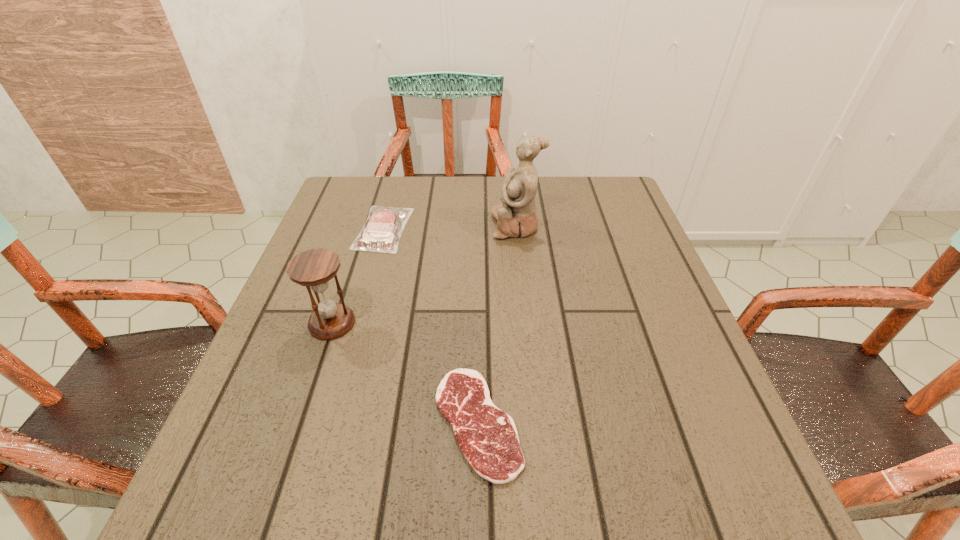
Locate an element on the screen. vacant position located 0.170m on the back of the hourglass is located at coordinates (354, 255).

Locate an element on the screen. free space located 0.340m on the front of the left steak is located at coordinates (344, 374).

Identify the location of free space located 0.240m on the back of the shortest object. Image resolution: width=960 pixels, height=540 pixels. (478, 282).

Where is `figurine that is positioned at the far edge`? The image size is (960, 540). figurine that is positioned at the far edge is located at coordinates (516, 216).

Where is `steak located at the far edge`? This screenshot has height=540, width=960. steak located at the far edge is located at coordinates (382, 230).

In order to click on object located at the near edge in this screenshot , I will do `click(487, 436)`.

Identify the location of hourglass that is at the left edge. (x=313, y=268).

Find the location of a particular element. The height and width of the screenshot is (540, 960). steak present at the left edge is located at coordinates (382, 230).

At what (x,y) coordinates should I click in order to perform the action: click on object that is at the far left corner. Please return your answer as a coordinate pair (x, y). Looking at the image, I should click on (382, 230).

Find the location of a particular element. The image size is (960, 540). vacant point at the far edge is located at coordinates (405, 201).